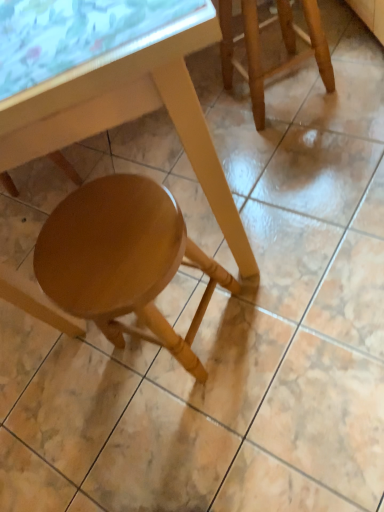
Question: Is wooden stool at upper right, the 1th stool viewed from the right, in front of or behind glossy wood stool at lower center, which is the second stool in top-to-bottom order, in the image?

Choices:
 (A) front
 (B) behind

Answer: (B)

Question: Considering the positions of wooden stool at upper right, the 1th stool viewed from the right, and glossy wood stool at lower center, which is counted as the 2th stool, starting from the right, in the image, is wooden stool at upper right, the 1th stool viewed from the right, taller or shorter than glossy wood stool at lower center, which is counted as the 2th stool, starting from the right,?

Choices:
 (A) tall
 (B) short

Answer: (B)

Question: Which is farther from the wooden stool at upper right, the 1th stool positioned from the top?

Choices:
 (A) matte wood table at lower center
 (B) glossy wood stool at lower center, which is the 1th stool in left-to-right order
 (C) transparent glass table at upper left

Answer: (C)

Question: Based on their relative distances, which object is farther from the glossy wood stool at lower center, marked as the first stool in a bottom-to-top arrangement?

Choices:
 (A) wooden stool at upper right, the 1th stool viewed from the right
 (B) transparent glass table at upper left
 (C) matte wood table at lower center

Answer: (A)